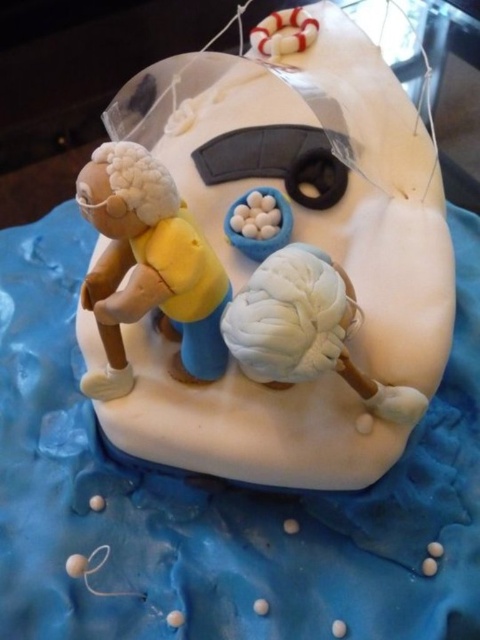
Question: Which point is farther to the camera?

Choices:
 (A) (339, 275)
 (B) (365, 358)
 (C) (133, 195)

Answer: (B)

Question: Does matte white boat at center appear on the right side of white clay brain at center?

Choices:
 (A) yes
 (B) no

Answer: (B)

Question: Does matte white boat at center appear over white clay brain at center?

Choices:
 (A) yes
 (B) no

Answer: (A)

Question: Considering the real-world distances, which object is closest to the matte white boat at center?

Choices:
 (A) matte yellow figure at left
 (B) white clay brain at center

Answer: (A)

Question: Can you confirm if matte yellow figure at left is positioned below white clay brain at center?

Choices:
 (A) yes
 (B) no

Answer: (B)

Question: Among these points, which one is farthest from the camera?

Choices:
 (A) (421, 131)
 (B) (375, 385)
 (C) (131, 294)

Answer: (A)